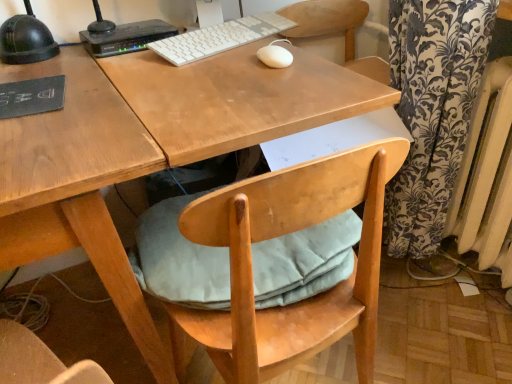
Question: Considering the positions of black plastic router at upper left and white painted metal radiator at right in the image, is black plastic router at upper left bigger or smaller than white painted metal radiator at right?

Choices:
 (A) small
 (B) big

Answer: (A)

Question: In terms of width, does black plastic router at upper left look wider or thinner when compared to white painted metal radiator at right?

Choices:
 (A) thin
 (B) wide

Answer: (A)

Question: Which object is the farthest from the white painted metal radiator at right?

Choices:
 (A) black plastic router at upper left
 (B) white plastic keyboard at upper center
 (C) light blue fabric cushion at under desk
 (D) white matte mouse at center

Answer: (A)

Question: Which of these objects is positioned closest to the white matte mouse at center?

Choices:
 (A) white plastic keyboard at upper center
 (B) black plastic router at upper left
 (C) light blue fabric cushion at under desk
 (D) white painted metal radiator at right

Answer: (A)